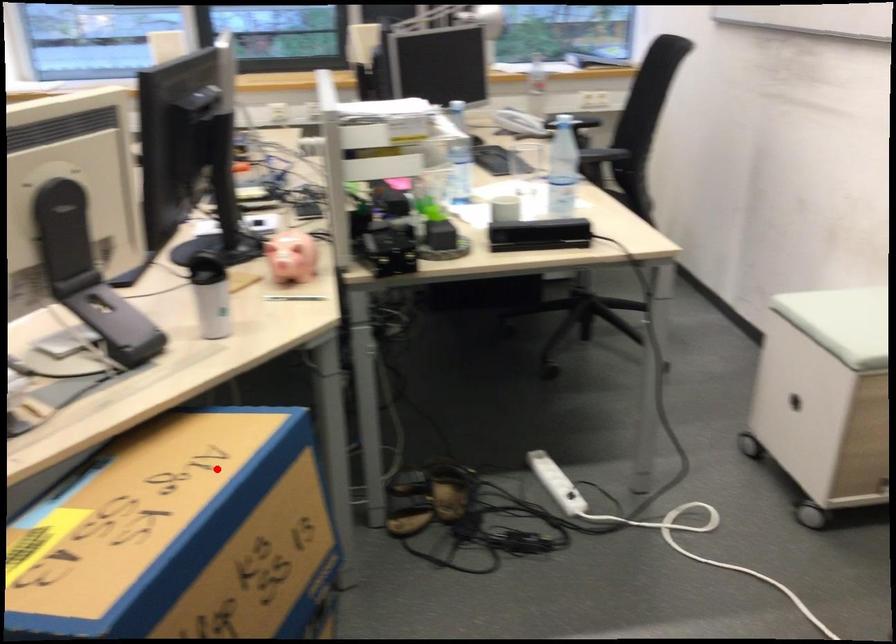
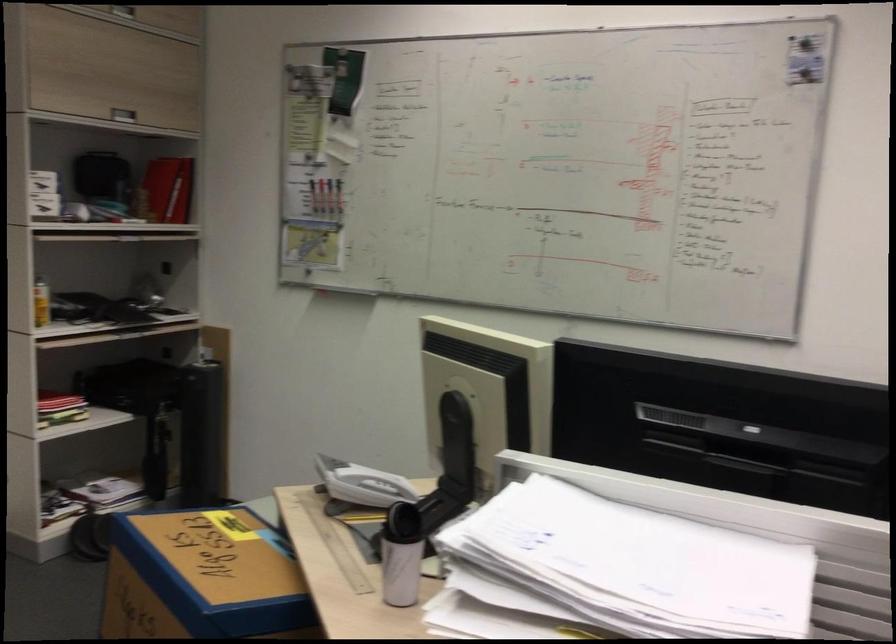
Question: I am providing you with two images of the same scene from different viewpoints. A red point is shown in image1. For the corresponding object point in image2, is it positioned nearer or farther from the camera?

Choices:
 (A) Nearer
 (B) Farther

Answer: (B)